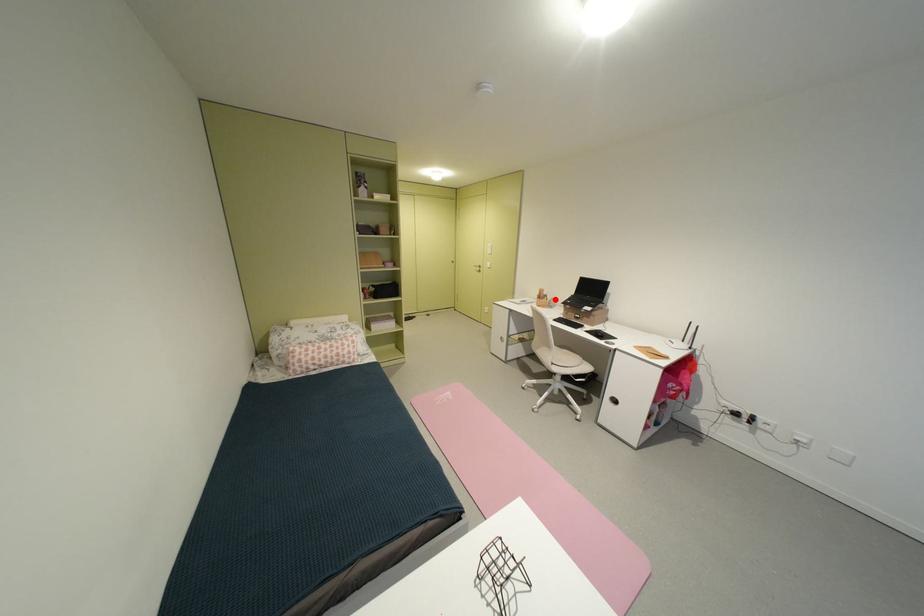
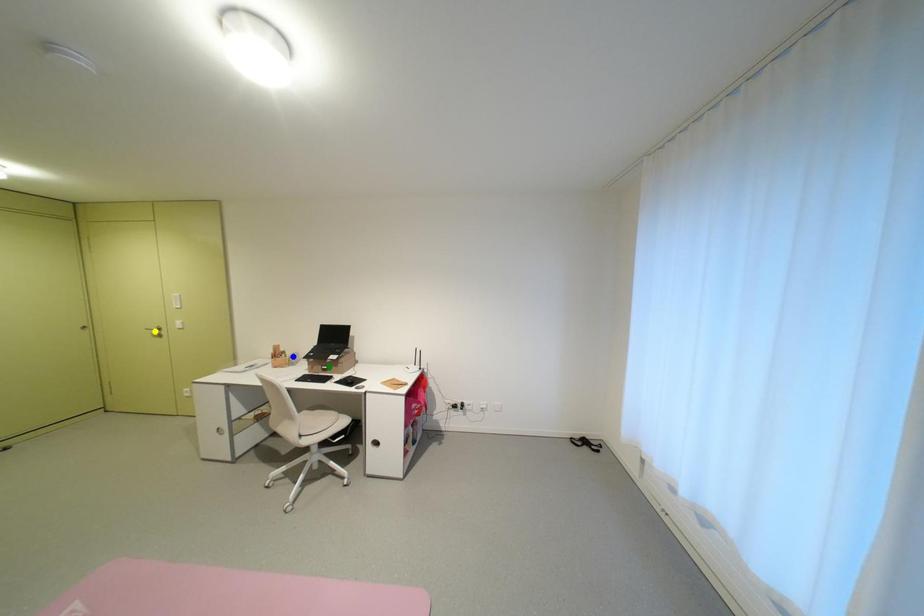
Question: I am providing you with two images of the same scene from different viewpoints. A red point is marked on the first image. You are given multiple points on the second image. In image 2, which mark is for the same physical point as the one in image 1?

Choices:
 (A) green point
 (B) yellow point
 (C) blue point

Answer: (C)